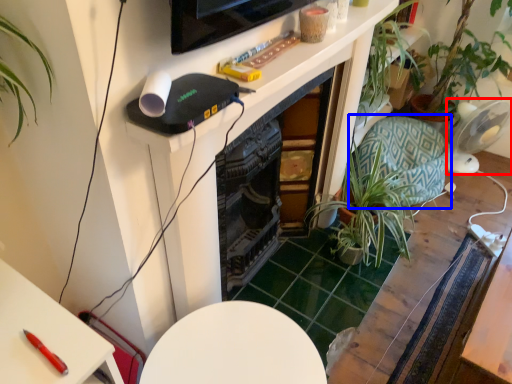
Question: Which point is further to the camera, appliance (highlighted by a red box) or swivel chair (highlighted by a blue box)?

Choices:
 (A) appliance
 (B) swivel chair

Answer: (A)